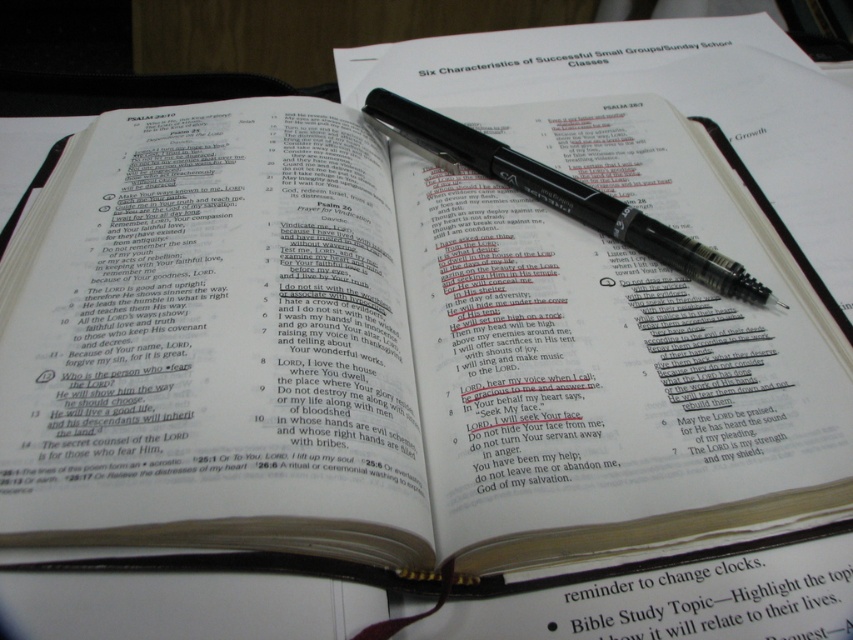
Question: Does white paper at center come in front of black plastic pen at center?

Choices:
 (A) no
 (B) yes

Answer: (B)

Question: Does black plastic pen at center appear on the right side of white paper at upper center?

Choices:
 (A) no
 (B) yes

Answer: (A)

Question: Which of the following is the farthest from the observer?

Choices:
 (A) black plastic pen at center
 (B) white paper at center

Answer: (A)

Question: Which point is closer to the camera?

Choices:
 (A) (827, 630)
 (B) (636, 220)
 (C) (457, 74)

Answer: (A)

Question: Does white paper at center have a greater width compared to white paper at upper center?

Choices:
 (A) yes
 (B) no

Answer: (B)

Question: Which object is the farthest from the black plastic pen at center?

Choices:
 (A) white paper at center
 (B) white paper at upper center

Answer: (A)